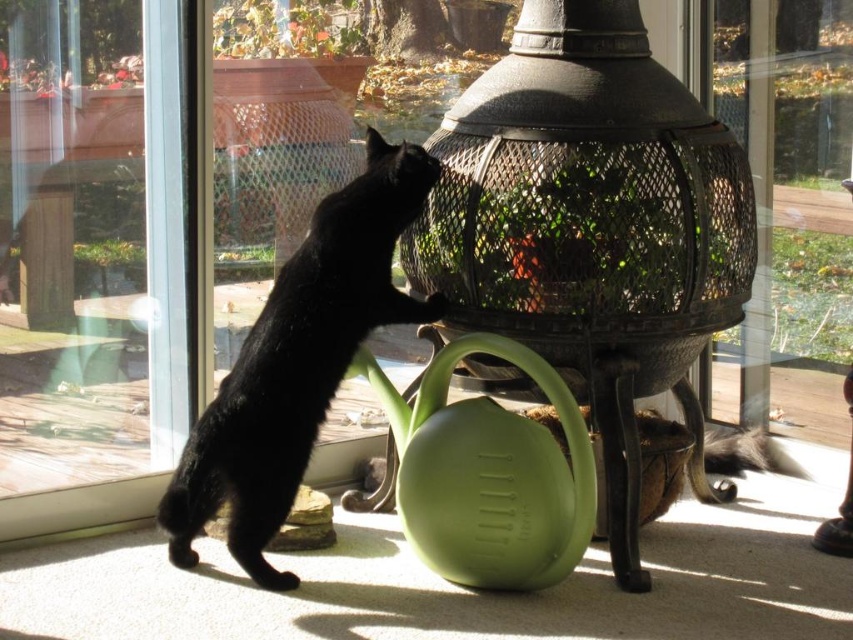
Question: Which point is closer to the camera?

Choices:
 (A) metallic wire birdcage at center
 (B) black glossy fur cat at left

Answer: (B)

Question: Is metallic wire birdcage at center wider than black glossy fur cat at left?

Choices:
 (A) yes
 (B) no

Answer: (A)

Question: Which of the following is the farthest from the observer?

Choices:
 (A) (38, 189)
 (B) (582, 33)
 (C) (258, 456)

Answer: (A)

Question: In this image, where is metallic wire birdcage at center located relative to black glossy fur cat at left?

Choices:
 (A) right
 (B) left

Answer: (A)

Question: Considering the real-world distances, which object is farthest from the black glossy fur cat at left?

Choices:
 (A) transparent glass screen door at left
 (B) metallic wire birdcage at center

Answer: (A)

Question: Can you confirm if metallic wire birdcage at center is positioned to the left of transparent glass screen door at left?

Choices:
 (A) no
 (B) yes

Answer: (A)